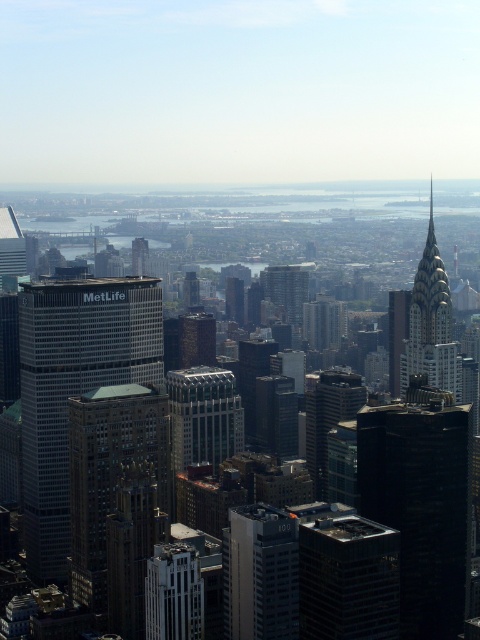
Between point (288, 556) and point (285, 280), which one is positioned in front?

Point (285, 280) is more forward.

Between white glass building at center and matte glass building at center, which one has more height?

white glass building at center is taller.

This screenshot has width=480, height=640. What are the coordinates of `white glass building at center` in the screenshot? It's located at 261,573.

Find the location of a particular element. white glass building at center is located at coordinates (261, 573).

The image size is (480, 640). I want to click on brown brick building at center, so click(x=74, y=387).

Is the position of brown brick building at center more distant than that of brown stone building at center?

No, it is in front of brown stone building at center.

Where is `brown brick building at center`? brown brick building at center is located at coordinates (74, 387).

Which is below, silver metallic spire at upper right or matte glass skyscraper at left?

silver metallic spire at upper right is below.

Between silver metallic spire at upper right and matte glass skyscraper at left, which one appears on the left side from the viewer's perspective?

Positioned to the left is matte glass skyscraper at left.

This screenshot has width=480, height=640. In order to click on silver metallic spire at upper right in this screenshot , I will do `click(431, 324)`.

Where is `silver metallic spire at upper right`? silver metallic spire at upper right is located at coordinates (431, 324).